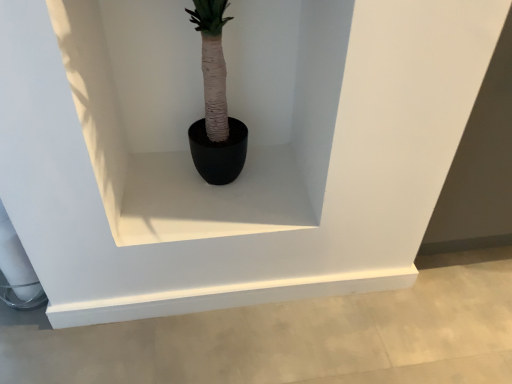
Question: Can you see white matte window sill at center touching black matte pot at center?

Choices:
 (A) yes
 (B) no

Answer: (B)

Question: Is white matte window sill at center positioned in front of black matte pot at center?

Choices:
 (A) yes
 (B) no

Answer: (B)

Question: From a real-world perspective, is white matte window sill at center positioned under black matte pot at center based on gravity?

Choices:
 (A) yes
 (B) no

Answer: (A)

Question: Can you confirm if white matte window sill at center is positioned to the right of black matte pot at center?

Choices:
 (A) yes
 (B) no

Answer: (B)

Question: Is white matte window sill at center located outside black matte pot at center?

Choices:
 (A) no
 (B) yes

Answer: (B)

Question: Does white matte window sill at center appear on the left side of black matte pot at center?

Choices:
 (A) yes
 (B) no

Answer: (A)

Question: Is black matte pot at center positioned behind white matte window sill at center?

Choices:
 (A) yes
 (B) no

Answer: (B)

Question: From a real-world perspective, does black matte pot at center sit lower than white matte window sill at center?

Choices:
 (A) yes
 (B) no

Answer: (B)

Question: Is white matte window sill at center located within black matte pot at center?

Choices:
 (A) no
 (B) yes

Answer: (A)

Question: Is black matte pot at center at the left side of white matte window sill at center?

Choices:
 (A) yes
 (B) no

Answer: (B)

Question: Does black matte pot at center turn towards white matte window sill at center?

Choices:
 (A) no
 (B) yes

Answer: (A)

Question: Can you confirm if black matte pot at center is wider than white matte window sill at center?

Choices:
 (A) no
 (B) yes

Answer: (A)

Question: Do you think black matte pot at center is within white matte window sill at center, or outside of it?

Choices:
 (A) outside
 (B) inside

Answer: (A)